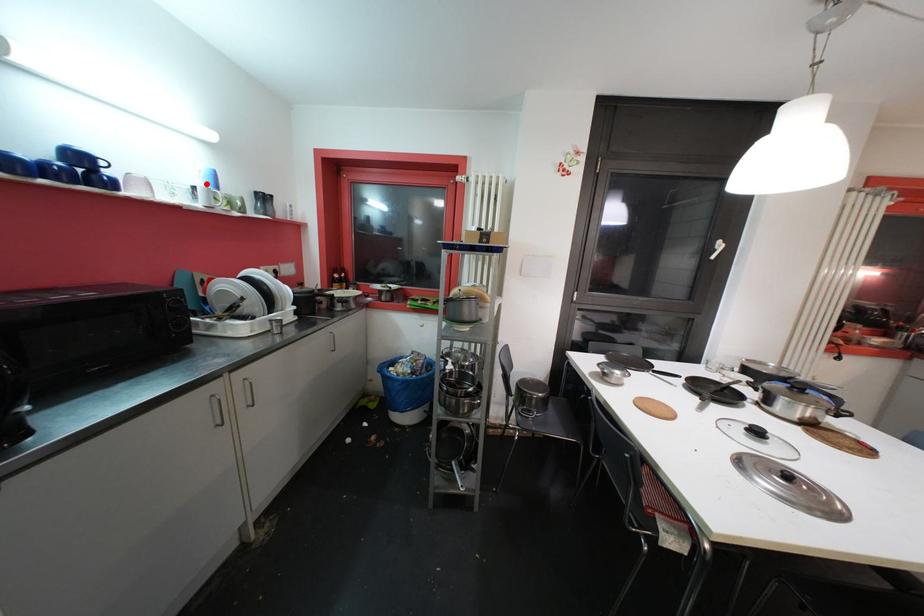
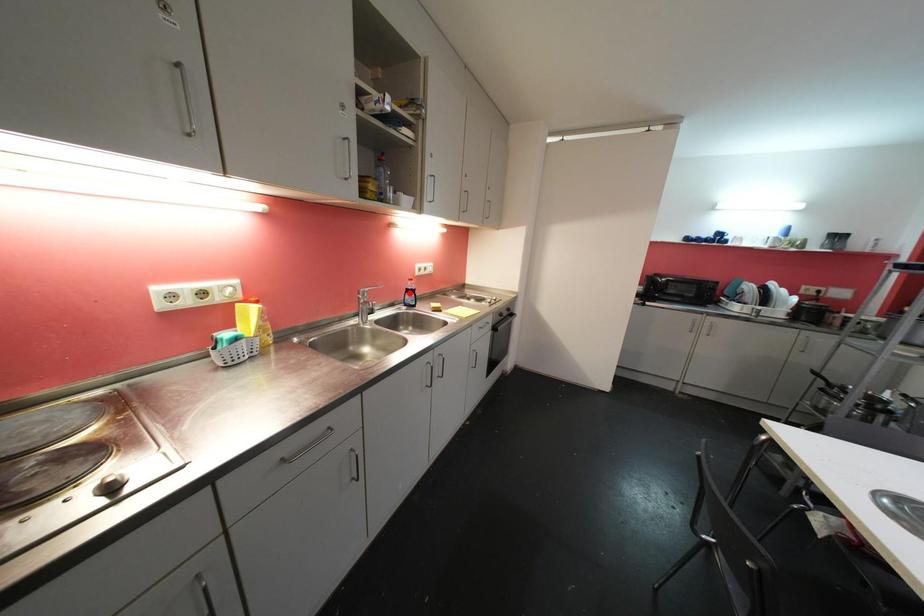
I am providing you with two images of the same scene from different viewpoints. A red point is marked on the first image and another point is marked on the second image. Is the marked point in image1 the same physical position as the marked point in image2?

No